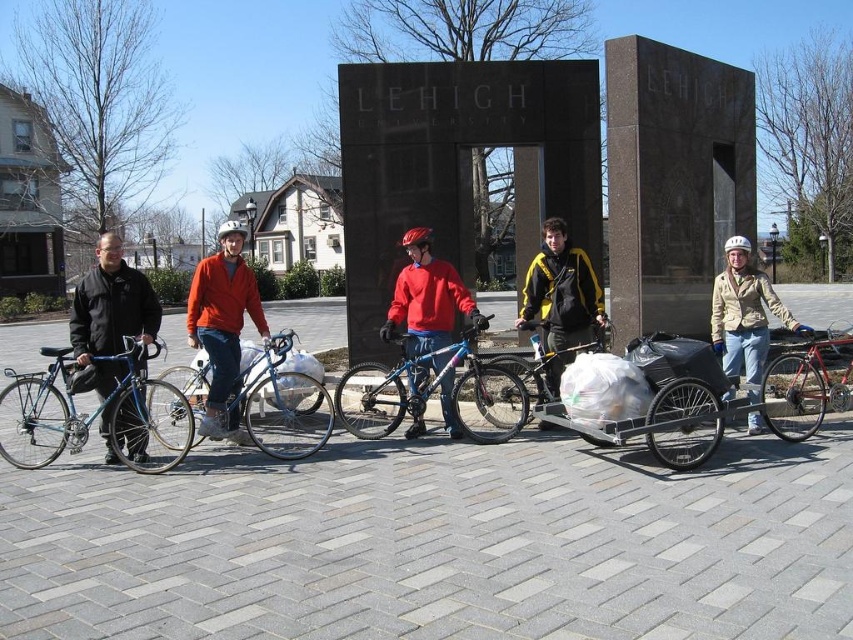
Question: Among these objects, which one is nearest to the camera?

Choices:
 (A) shiny blue bicycle at left
 (B) blue matte bicycle at center
 (C) blue metallic bicycle at center
 (D) shiny blue bicycle at center

Answer: (A)

Question: Which of the following is the farthest from the observer?

Choices:
 (A) 544,349
 (B) 282,417
 (C) 115,380
 (D) 450,355

Answer: (B)

Question: Does black matte cargo bike at center appear on the left side of black matte jacket at left?

Choices:
 (A) no
 (B) yes

Answer: (A)

Question: Which object is closer to the camera taking this photo?

Choices:
 (A) shiny blue bicycle at left
 (B) blue metallic bicycle at center
 (C) black matte cargo bike at center
 (D) shiny red bicycle at right

Answer: (C)

Question: Is blue metallic bicycle at center below blue matte bicycle at center?

Choices:
 (A) yes
 (B) no

Answer: (A)

Question: Can you confirm if blue metallic bicycle at center is wider than matte blue bicycle at center?

Choices:
 (A) yes
 (B) no

Answer: (A)